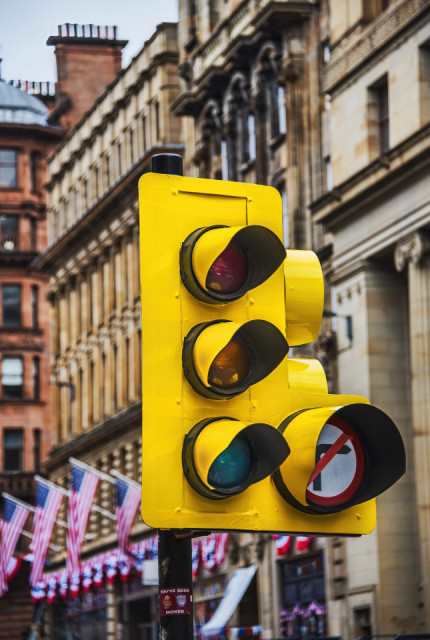
Where is `light`? The width and height of the screenshot is (430, 640). light is located at coordinates (204, 258).